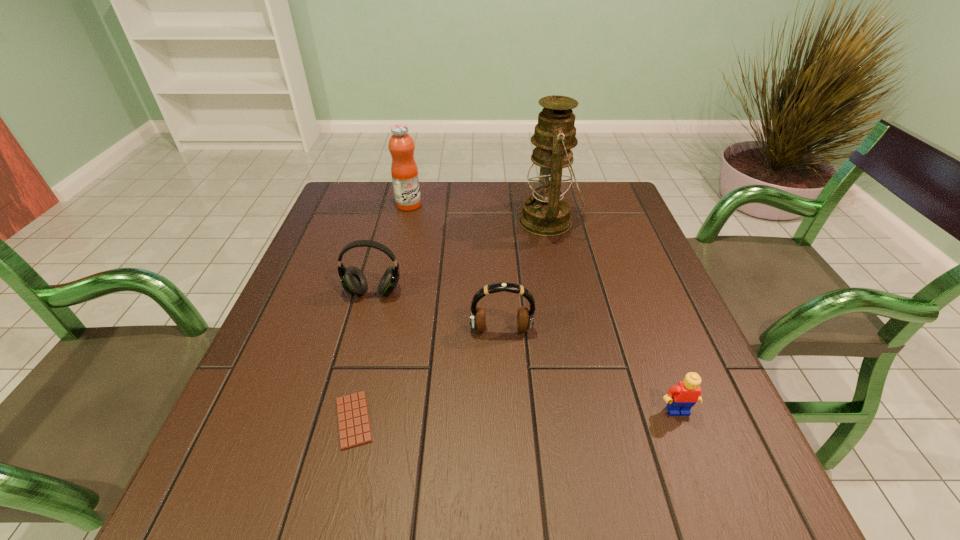
You are a GUI agent. You are given a task and a screenshot of the screen. Output one action in this format:
    pyautogui.click(x=<x>, y=<y>)
    Task: Click on the oil lamp
    
    Given the screenshot: What is the action you would take?
    pyautogui.click(x=546, y=213)

Where is `fruit juice`? This screenshot has width=960, height=540. fruit juice is located at coordinates (404, 170).

This screenshot has height=540, width=960. In order to click on the third farthest object in this screenshot , I will do `click(354, 282)`.

Locate an element on the screen. Image resolution: width=960 pixels, height=540 pixels. the farther headset is located at coordinates (354, 282).

Image resolution: width=960 pixels, height=540 pixels. I want to click on the right headset, so click(525, 318).

Locate an element on the screen. the nearer headset is located at coordinates (525, 318).

In order to click on Lego in this screenshot , I will do `click(680, 399)`.

Locate an element on the screen. Image resolution: width=960 pixels, height=540 pixels. the rightmost object is located at coordinates (680, 399).

The width and height of the screenshot is (960, 540). I want to click on candy bar, so click(353, 420).

The height and width of the screenshot is (540, 960). Find the location of `free spot located 0.240m on the front of the tallest object`. free spot located 0.240m on the front of the tallest object is located at coordinates (566, 308).